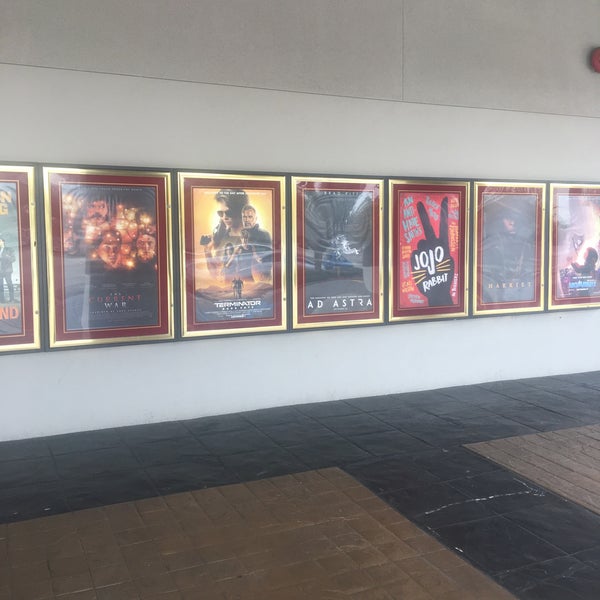
Locate an element on the screen. wall is located at coordinates pyautogui.click(x=247, y=124).